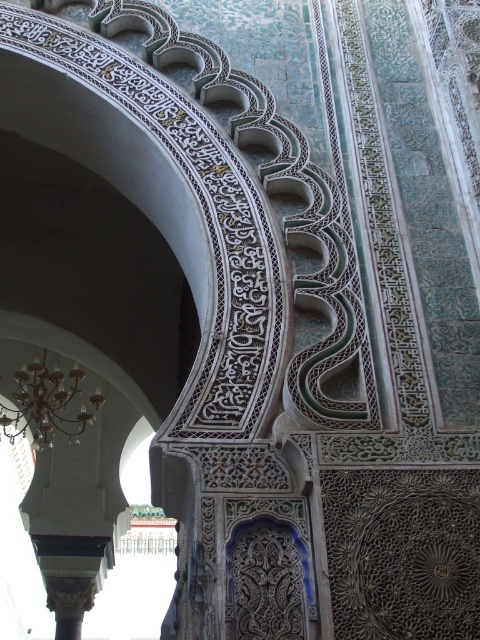
You are standing in this historical building and want to hang a new decoration. The gold metallic chandelier at upper center and the carved stone column at lower left are in your view. Which object is positioned higher from the ground?

The gold metallic chandelier at upper center is positioned higher from the ground than the carved stone column at lower left because it is above it.

You are an interior designer assessing the proportions of the space. Given the gold metallic chandelier at upper center and the carved stone column at lower left, which object has a greater width?

The gold metallic chandelier at upper center has a greater width than the carved stone column at lower left.